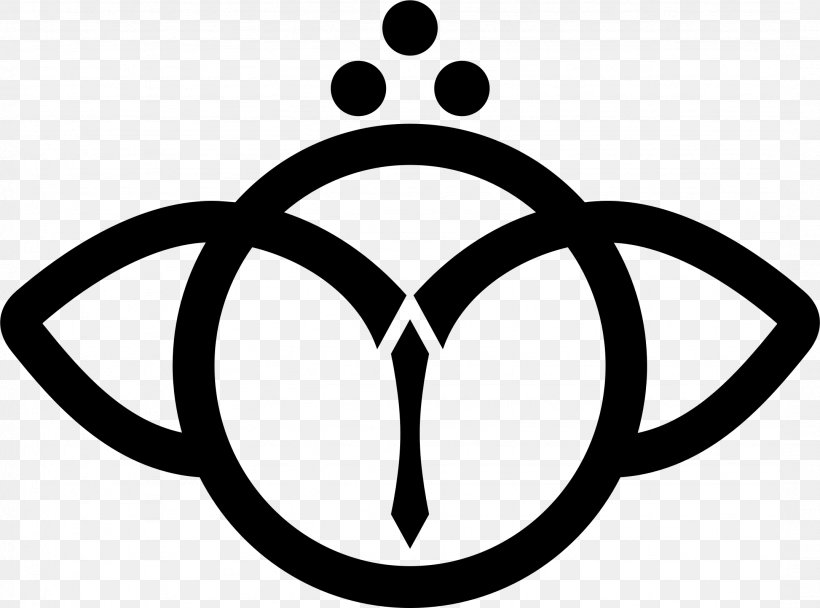
I want to click on artwork, so click(x=631, y=337).